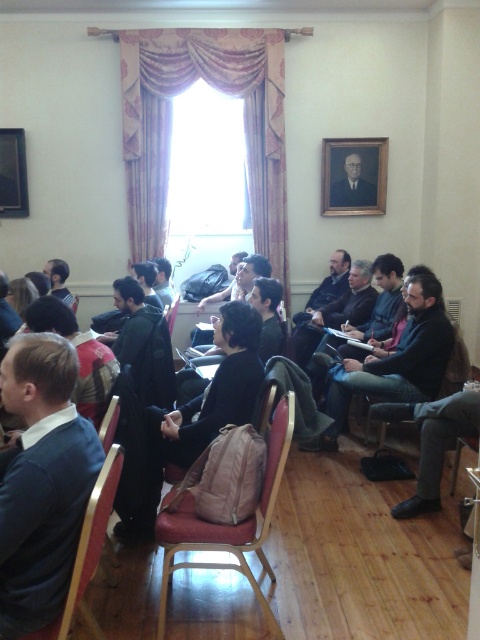
Question: Can you confirm if leather-like brown chair at lower left is positioned above wooden picture frame at upper left?

Choices:
 (A) yes
 (B) no

Answer: (B)

Question: Observing the image, what is the correct spatial positioning of wooden picture frame at upper left in reference to metallic silver chair at lower right?

Choices:
 (A) below
 (B) above

Answer: (B)

Question: Which object is closer to the camera taking this photo?

Choices:
 (A) wooden picture frame at upper left
 (B) wooden portrait frame at upper center

Answer: (A)

Question: Which point is closer to the camera?

Choices:
 (A) dark gray sweater at center
 (B) metallic silver chair at lower right
 (C) wooden chair at center

Answer: (B)

Question: Where is brown leather backpack at center located in relation to dark gray sweater at center in the image?

Choices:
 (A) above
 (B) below

Answer: (B)

Question: Which point appears closest to the camera in this image?

Choices:
 (A) (326, 408)
 (B) (360, 186)
 (C) (381, 435)

Answer: (C)